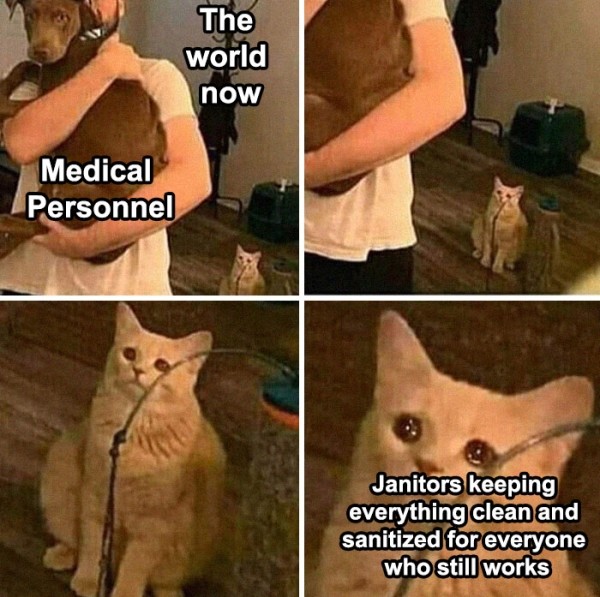
This screenshot has height=597, width=600. I want to click on water coming from shower head, so click(272, 507).